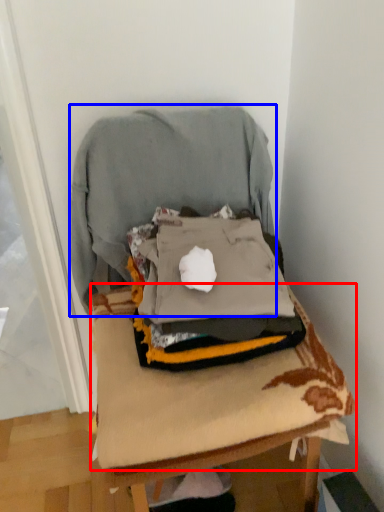
Question: Which of the following is the closest to the observer, sheet (highlighted by a red box) or sweatshirt (highlighted by a blue box)?

Choices:
 (A) sheet
 (B) sweatshirt

Answer: (A)